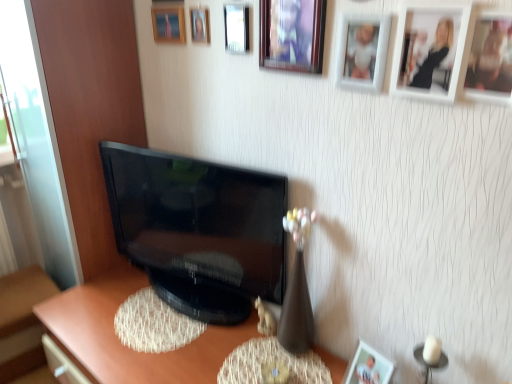
The image size is (512, 384). Describe the element at coordinates (362, 52) in the screenshot. I see `white matte picture frame at upper center, marked as the 4th picture frame in a right-to-left arrangement` at that location.

Describe the element at coordinates (265, 319) in the screenshot. I see `white plastic dog at lower center` at that location.

What do you see at coordinates (198, 230) in the screenshot?
I see `black glossy television at center` at bounding box center [198, 230].

The width and height of the screenshot is (512, 384). In order to click on matte wooden picture frame at upper center, the 7th picture frame positioned from the right in this screenshot , I will do `click(200, 25)`.

Which is in front, point (318, 56) or point (47, 330)?

The point (318, 56) is more forward.

Is wooden picture frame at upper center, positioned as the fifth picture frame in right-to-left order, beside matte brown desk at center?

No, wooden picture frame at upper center, positioned as the fifth picture frame in right-to-left order, is not with matte brown desk at center.

Considering the sizes of objects wooden picture frame at upper center, the 4th picture frame when ordered from top to bottom, and matte brown desk at center in the image provided, who is thinner, wooden picture frame at upper center, the 4th picture frame when ordered from top to bottom, or matte brown desk at center?

wooden picture frame at upper center, the 4th picture frame when ordered from top to bottom.

Is wooden picture frame at upper center, the 4th picture frame when ordered from top to bottom, not inside matte brown desk at center?

Absolutely, wooden picture frame at upper center, the 4th picture frame when ordered from top to bottom, is external to matte brown desk at center.

Which of these two, white matte picture frame at upper center, acting as the fifth picture frame starting from the top, or wooden photo frame at upper right, the 1th picture frame in the right-to-left sequence, is smaller?

wooden photo frame at upper right, the 1th picture frame in the right-to-left sequence, is smaller.

From the wooden photo frame at upper right, the 1th picture frame in the right-to-left sequence, count the 3rd picture frame to the left and point to it. Please provide its 2D coordinates.

[(362, 52)]

Considering the positions of objects white matte picture frame at upper center, which is the 4th picture frame in bottom-to-top order, and wooden photo frame at upper right, marked as the 2th picture frame in a bottom-to-top arrangement, in the image provided, who is more to the right, white matte picture frame at upper center, which is the 4th picture frame in bottom-to-top order, or wooden photo frame at upper right, marked as the 2th picture frame in a bottom-to-top arrangement,?

Positioned to the right is wooden photo frame at upper right, marked as the 2th picture frame in a bottom-to-top arrangement.

How many degrees apart are the facing directions of white matte picture frame at upper center, which is the 4th picture frame in bottom-to-top order, and wooden photo frame at upper right, marked as the 8th picture frame in a left-to-right arrangement?

There is a 0.00129-degree angle between the facing directions of white matte picture frame at upper center, which is the 4th picture frame in bottom-to-top order, and wooden photo frame at upper right, marked as the 8th picture frame in a left-to-right arrangement.

Is wooden photo frame at upper right, marked as the 8th picture frame in a left-to-right arrangement, inside or outside of wooden picture frame at upper center, which ranks as the 8th picture frame in bottom-to-top order?

wooden photo frame at upper right, marked as the 8th picture frame in a left-to-right arrangement, is spatially situated outside wooden picture frame at upper center, which ranks as the 8th picture frame in bottom-to-top order.

From the image's perspective, relative to wooden picture frame at upper center, the 1th picture frame in the top-to-bottom sequence, is wooden photo frame at upper right, which is the 7th picture frame from top to bottom, above or below?

wooden photo frame at upper right, which is the 7th picture frame from top to bottom, is below wooden picture frame at upper center, the 1th picture frame in the top-to-bottom sequence.

From a real-world perspective, which object rests below the other?

wooden photo frame at upper right, marked as the 8th picture frame in a left-to-right arrangement, from a real-world perspective.

Which of these two, wooden photo frame at upper right, marked as the 2th picture frame in a bottom-to-top arrangement, or wooden picture frame at upper center, which ranks as the 8th picture frame in right-to-left order, stands taller?

Standing taller between the two is wooden photo frame at upper right, marked as the 2th picture frame in a bottom-to-top arrangement.

From a real-world perspective, is matte wooden picture frame at upper center, the 7th picture frame positioned from the right, positioned above or below white matte picture frame at upper center, acting as the fifth picture frame starting from the top?

Clearly, from a real-world perspective, matte wooden picture frame at upper center, the 7th picture frame positioned from the right, is above white matte picture frame at upper center, acting as the fifth picture frame starting from the top.

Can you tell me how much matte wooden picture frame at upper center, acting as the second picture frame starting from the left, and white matte picture frame at upper center, marked as the 4th picture frame in a right-to-left arrangement, differ in facing direction?

The angle between the facing direction of matte wooden picture frame at upper center, acting as the second picture frame starting from the left, and the facing direction of white matte picture frame at upper center, marked as the 4th picture frame in a right-to-left arrangement, is 8.91e-05 degrees.

Is matte wooden picture frame at upper center, acting as the second picture frame starting from the left, facing away from white matte picture frame at upper center, which is the 4th picture frame in bottom-to-top order?

No, white matte picture frame at upper center, which is the 4th picture frame in bottom-to-top order, is not at the back of matte wooden picture frame at upper center, acting as the second picture frame starting from the left.

In the scene shown: Considering the sizes of matte wooden picture frame at upper center, the second picture frame from the top, and white matte picture frame at upper center, which is the 4th picture frame in bottom-to-top order, in the image, is matte wooden picture frame at upper center, the second picture frame from the top, bigger or smaller than white matte picture frame at upper center, which is the 4th picture frame in bottom-to-top order,?

In the image, matte wooden picture frame at upper center, the second picture frame from the top, appears to be smaller than white matte picture frame at upper center, which is the 4th picture frame in bottom-to-top order.

Does point (496, 78) lie behind point (205, 31)?

No, it is in front of (205, 31).

This screenshot has height=384, width=512. I want to click on the 6th picture frame in front of the matte wooden picture frame at upper center, the 7th picture frame positioned from the right, counting from the anchor's position, so click(x=490, y=59).

Do you think wooden photo frame at upper right, the 1th picture frame in the right-to-left sequence, is within matte wooden picture frame at upper center, acting as the second picture frame starting from the left, or outside of it?

wooden photo frame at upper right, the 1th picture frame in the right-to-left sequence, cannot be found inside matte wooden picture frame at upper center, acting as the second picture frame starting from the left.

Does point (159, 24) appear closer or farther from the camera than point (169, 230)?

Clearly, point (159, 24) is closer to the camera than point (169, 230).

Can you confirm if wooden picture frame at upper center, which ranks as the 8th picture frame in right-to-left order, is smaller than black glossy television at center?

Yes, wooden picture frame at upper center, which ranks as the 8th picture frame in right-to-left order, is smaller than black glossy television at center.

Who is more distant, wooden picture frame at upper center, which ranks as the 8th picture frame in right-to-left order, or black glossy television at center?

wooden picture frame at upper center, which ranks as the 8th picture frame in right-to-left order, is more distant.

Is wooden picture frame at upper center, which ranks as the 8th picture frame in bottom-to-top order, directly adjacent to black glossy television at center?

No, wooden picture frame at upper center, which ranks as the 8th picture frame in bottom-to-top order, is not making contact with black glossy television at center.

Is matte brown desk at center at the right side of wooden picture frame at upper center, which ranks as the 8th picture frame in bottom-to-top order?

Correct, you'll find matte brown desk at center to the right of wooden picture frame at upper center, which ranks as the 8th picture frame in bottom-to-top order.

Does matte brown desk at center contain wooden picture frame at upper center, the 1th picture frame in the top-to-bottom sequence?

That's incorrect, wooden picture frame at upper center, the 1th picture frame in the top-to-bottom sequence, is not inside matte brown desk at center.

Is matte brown desk at center taller or shorter than wooden picture frame at upper center, the first picture frame viewed from the left?

In the image, matte brown desk at center appears to be taller than wooden picture frame at upper center, the first picture frame viewed from the left.

Where is `desk that is on the right side of wooden picture frame at upper center, the 1th picture frame in the top-to-bottom sequence`? This screenshot has height=384, width=512. desk that is on the right side of wooden picture frame at upper center, the 1th picture frame in the top-to-bottom sequence is located at coordinates (124, 346).

You are a GUI agent. You are given a task and a screenshot of the screen. Output one action in this format:
    pyautogui.click(x=<x>, y=<y>)
    Task: Click on the desk on the left of wooden picture frame at upper center, the 4th picture frame when ordered from left to right
    The height and width of the screenshot is (384, 512).
    Given the screenshot: What is the action you would take?
    pyautogui.click(x=124, y=346)

From a real-world perspective, starting from the wooden photo frame at upper right, which is the 7th picture frame from top to bottom, which picture frame is the 2nd one below it? Please provide its 2D coordinates.

[(362, 52)]

Considering their positions, is matte brown desk at center positioned further to white matte picture frame at upper right, arranged as the 7th picture frame when viewed from the left, than wooden picture frame at upper center, which appears as the 5th picture frame when ordered from the bottom?

Based on the image, matte brown desk at center appears to be further to white matte picture frame at upper right, arranged as the 7th picture frame when viewed from the left.

Looking at the image, which one is located closer to matte brown desk at center, matte glass picture frame at upper center, arranged as the third picture frame when viewed from the left, or black glossy television at center?

Among the two, black glossy television at center is located nearer to matte brown desk at center.

From the image, which object appears to be nearer to white matte picture frame at upper right, the third picture frame when ordered from bottom to top, matte wooden picture frame at upper center, the 7th picture frame positioned from the right, or matte glass picture frame at upper center, which appears as the 6th picture frame when viewed from the right?

Among the two, matte glass picture frame at upper center, which appears as the 6th picture frame when viewed from the right, is located nearer to white matte picture frame at upper right, the third picture frame when ordered from bottom to top.

Estimate the real-world distances between objects in this image. Which object is further from wooden picture frame at upper center, positioned as the fifth picture frame in right-to-left order, matte glass picture frame at upper center, marked as the 3th picture frame in a top-to-bottom arrangement, or white matte picture frame at upper right, arranged as the 7th picture frame when viewed from the left?

white matte picture frame at upper right, arranged as the 7th picture frame when viewed from the left, lies further to wooden picture frame at upper center, positioned as the fifth picture frame in right-to-left order, than the other object.

In the scene shown: Considering their positions, is white matte picture frame at upper center, acting as the fifth picture frame starting from the top, positioned closer to wooden photo frame at upper right, the 1th picture frame in the right-to-left sequence, than white plastic dog at lower center?

Based on the image, white matte picture frame at upper center, acting as the fifth picture frame starting from the top, appears to be nearer to wooden photo frame at upper right, the 1th picture frame in the right-to-left sequence.

From the image, which object appears to be nearer to white plastic dog at lower center, black glossy television at center or matte glass picture frame at upper center, the 6th picture frame when ordered from bottom to top?

black glossy television at center lies closer to white plastic dog at lower center than the other object.

When comparing their distances from wooden picture frame at upper center, positioned as the fifth picture frame in right-to-left order, does wooden photo frame at upper right, the 1th picture frame in the right-to-left sequence, or black glossy television at center seem closer?

wooden photo frame at upper right, the 1th picture frame in the right-to-left sequence, is positioned closer to the anchor wooden picture frame at upper center, positioned as the fifth picture frame in right-to-left order.

Which object lies further to the anchor point wooden picture frame at upper center, which ranks as the 8th picture frame in bottom-to-top order, matte white picture frame at lower right, the sixth picture frame in the left-to-right sequence, or white matte picture frame at upper center, positioned as the 5th picture frame in left-to-right order?

Based on the image, matte white picture frame at lower right, the sixth picture frame in the left-to-right sequence, appears to be further to wooden picture frame at upper center, which ranks as the 8th picture frame in bottom-to-top order.

You are a GUI agent. You are given a task and a screenshot of the screen. Output one action in this format:
    pyautogui.click(x=<x>, y=<y>)
    Task: Click on the television between white matte picture frame at upper center, marked as the 4th picture frame in a right-to-left arrangement, and matte white picture frame at lower right, the 3th picture frame positioned from the right, vertically
    This screenshot has width=512, height=384.
    Given the screenshot: What is the action you would take?
    pyautogui.click(x=198, y=230)

This screenshot has width=512, height=384. Identify the location of television between wooden picture frame at upper center, the first picture frame viewed from the left, and white plastic dog at lower center in the up-down direction. (198, 230).

Where is `picture frame between wooden photo frame at upper right, the 1th picture frame in the right-to-left sequence, and matte brown desk at center, in the vertical direction`? The image size is (512, 384). picture frame between wooden photo frame at upper right, the 1th picture frame in the right-to-left sequence, and matte brown desk at center, in the vertical direction is located at coordinates (367, 366).

Where is `television between wooden picture frame at upper center, which ranks as the 8th picture frame in right-to-left order, and wooden photo frame at upper right, marked as the 2th picture frame in a bottom-to-top arrangement`? The image size is (512, 384). television between wooden picture frame at upper center, which ranks as the 8th picture frame in right-to-left order, and wooden photo frame at upper right, marked as the 2th picture frame in a bottom-to-top arrangement is located at coordinates 198,230.